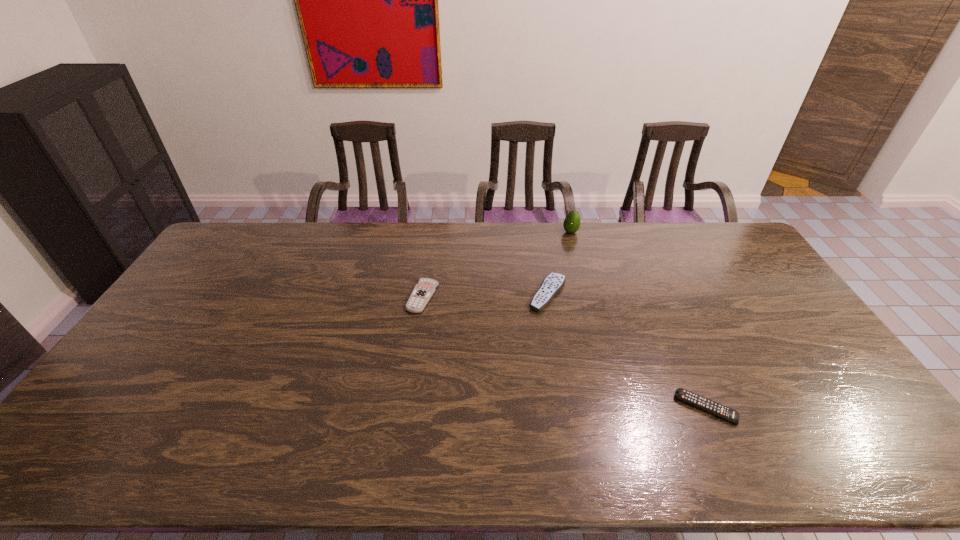
Where is `vacant region between the leftmost remote control and the tallest object`? vacant region between the leftmost remote control and the tallest object is located at coordinates (496, 265).

What are the coordinates of `unoccupied position between the nearest remote control and the leftmost remote control` in the screenshot? It's located at (564, 352).

At what (x,y) coordinates should I click in order to perform the action: click on free point between the rightmost object and the farthest object. Please return your answer as a coordinate pair (x, y). The height and width of the screenshot is (540, 960). Looking at the image, I should click on (638, 320).

At what (x,y) coordinates should I click in order to perform the action: click on free space that is in between the third object from right to left and the leftmost object. Please return your answer as a coordinate pair (x, y). The image size is (960, 540). Looking at the image, I should click on (486, 296).

This screenshot has width=960, height=540. In order to click on vacant area between the rightmost object and the second object from right to left in this screenshot , I will do `click(638, 320)`.

Where is `vacant space that's between the leftmost remote control and the rightmost object`? vacant space that's between the leftmost remote control and the rightmost object is located at coordinates (564, 352).

What are the coordinates of `free space between the third object from left to right and the leftmost object` in the screenshot? It's located at click(496, 265).

Locate an element on the screen. object that stands as the closest to the nearest remote control is located at coordinates (553, 283).

Locate which object is the closest to the second remote control from right to left. Please provide its 2D coordinates. Your answer should be formatted as a tuple, i.e. [(x, y)], where the tuple contains the x and y coordinates of a point satisfying the conditions above.

[(572, 222)]

The height and width of the screenshot is (540, 960). What are the coordinates of `the third closest remote control to the third object from left to right` in the screenshot? It's located at (682, 394).